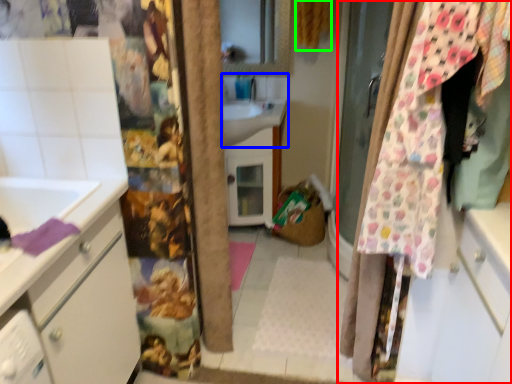
Question: Which object is positioned farthest from curtain (highlighted by a red box)? Select from sink (highlighted by a blue box) and curtain (highlighted by a green box).

Choices:
 (A) sink
 (B) curtain

Answer: (B)